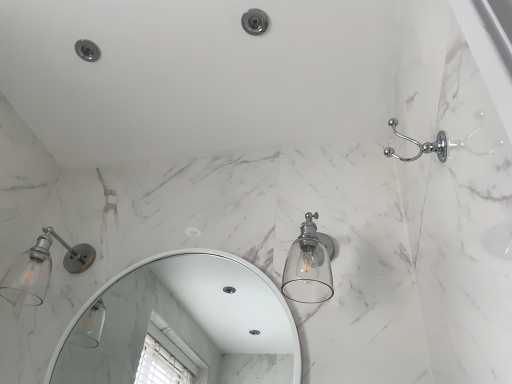
Question: From the image's perspective, is matte silver glass sconce at left, which is counted as the 1th light fixture, starting from the left, above white glossy mirror at center?

Choices:
 (A) yes
 (B) no

Answer: (A)

Question: Can you confirm if matte silver glass sconce at left, which is counted as the 1th light fixture, starting from the left, is shorter than white glossy mirror at center?

Choices:
 (A) no
 (B) yes

Answer: (B)

Question: Can you confirm if matte silver glass sconce at left, which is counted as the 1th light fixture, starting from the left, is wider than white glossy mirror at center?

Choices:
 (A) no
 (B) yes

Answer: (B)

Question: Considering the relative positions of matte silver glass sconce at left, which is counted as the 1th light fixture, starting from the left, and white glossy mirror at center in the image provided, is matte silver glass sconce at left, which is counted as the 1th light fixture, starting from the left, behind white glossy mirror at center?

Choices:
 (A) no
 (B) yes

Answer: (B)

Question: From the image's perspective, is matte silver glass sconce at left, which is counted as the 1th light fixture, starting from the left, below white glossy mirror at center?

Choices:
 (A) no
 (B) yes

Answer: (A)

Question: Is matte silver glass sconce at left, which is counted as the 1th light fixture, starting from the left, positioned before white glossy mirror at center?

Choices:
 (A) yes
 (B) no

Answer: (B)

Question: Can you confirm if matte white bathtub at upper right is taller than chrome metallic showerhead at upper center?

Choices:
 (A) no
 (B) yes

Answer: (B)

Question: Is the position of matte white bathtub at upper right less distant than that of chrome metallic showerhead at upper center?

Choices:
 (A) yes
 (B) no

Answer: (A)

Question: Is chrome metallic showerhead at upper center completely or partially inside matte white bathtub at upper right?

Choices:
 (A) yes
 (B) no

Answer: (A)

Question: Is matte white bathtub at upper right at the left side of chrome metallic showerhead at upper center?

Choices:
 (A) no
 (B) yes

Answer: (B)

Question: Considering the relative sizes of matte white bathtub at upper right and chrome metallic showerhead at upper center in the image provided, is matte white bathtub at upper right thinner than chrome metallic showerhead at upper center?

Choices:
 (A) yes
 (B) no

Answer: (B)

Question: Does matte white bathtub at upper right come behind chrome metallic showerhead at upper center?

Choices:
 (A) yes
 (B) no

Answer: (B)

Question: Can you confirm if chrome metallic showerhead at upper center is bigger than white glossy mirror at center?

Choices:
 (A) yes
 (B) no

Answer: (B)